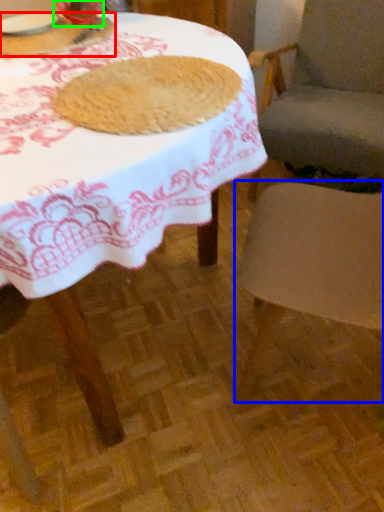
Question: Which is farther away from breakfast (highlighted by a red box)? chair (highlighted by a blue box) or tableware (highlighted by a green box)?

Choices:
 (A) chair
 (B) tableware

Answer: (A)